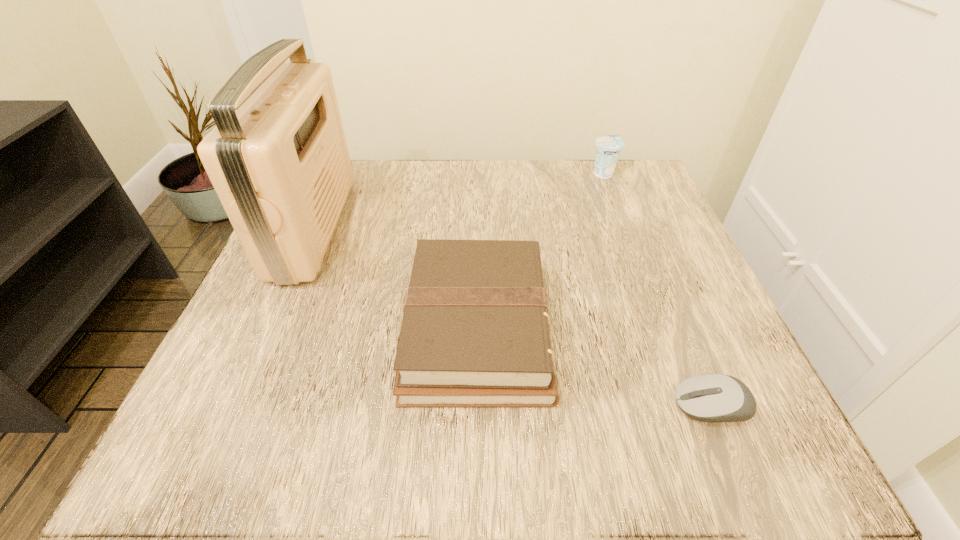
This screenshot has height=540, width=960. Find the location of `object located in the near right corner section of the desktop`. object located in the near right corner section of the desktop is located at coordinates (711, 397).

The width and height of the screenshot is (960, 540). In the image, there is a desktop. In order to click on vacant space at the far edge in this screenshot , I will do `click(508, 210)`.

The height and width of the screenshot is (540, 960). I want to click on free space at the near edge of the desktop, so click(600, 450).

The height and width of the screenshot is (540, 960). Identify the location of vacant region at the left edge. (317, 313).

The height and width of the screenshot is (540, 960). I want to click on free space at the right edge of the desktop, so click(x=695, y=364).

Locate an element on the screen. The width and height of the screenshot is (960, 540). free region at the far left corner is located at coordinates (368, 199).

What are the coordinates of `vacant space at the near left corner` in the screenshot? It's located at (275, 453).

Find the location of a particular element. vacant space at the near right corner of the desktop is located at coordinates (700, 447).

The height and width of the screenshot is (540, 960). I want to click on free space between the shortest object and the third object from right to left, so click(x=594, y=367).

You are a GUI agent. You are given a task and a screenshot of the screen. Output one action in this format:
    pyautogui.click(x=<x>, y=<y>)
    Task: Click on the vacant space in between the computer equipment and the second object from left to right
    This screenshot has height=540, width=960.
    Given the screenshot: What is the action you would take?
    pyautogui.click(x=594, y=367)